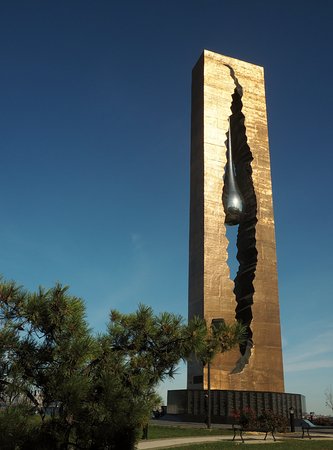
Where is `bench`? The image size is (333, 450). bench is located at coordinates (243, 430).